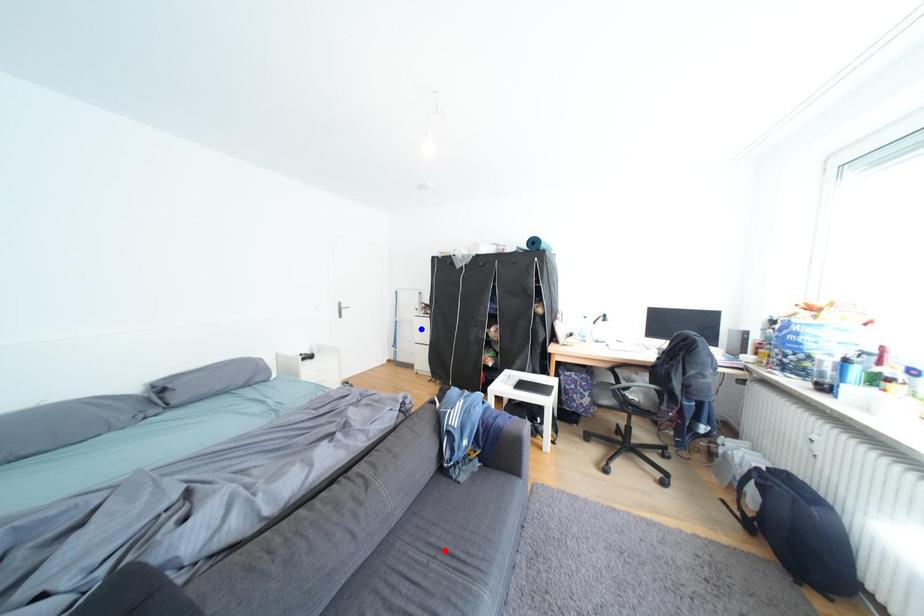
Question: Two points are marked on the image. Which point is closer to the camera?

Choices:
 (A) Blue point is closer.
 (B) Red point is closer.

Answer: (B)